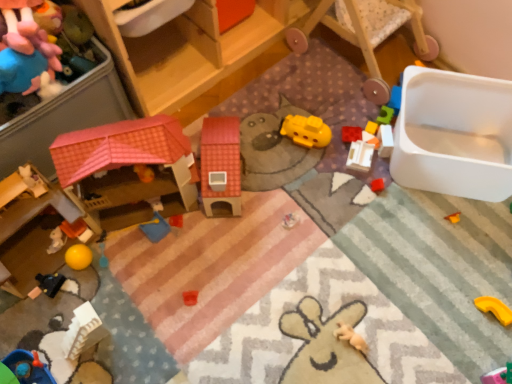
Where is `free space between rubber brick at upper right, which appears as the fifth toy when viewed from the right, and blue fabric toy at center, arranged as the third toy when viewed from the left`? The height and width of the screenshot is (384, 512). free space between rubber brick at upper right, which appears as the fifth toy when viewed from the right, and blue fabric toy at center, arranged as the third toy when viewed from the left is located at coordinates (261, 183).